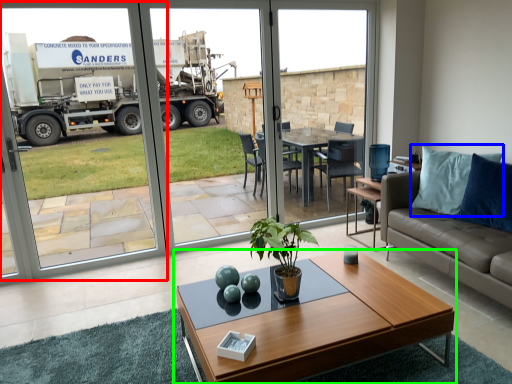
Question: Which is farther away from screen door (highlighted by a red box)? pillow (highlighted by a blue box) or coffee table (highlighted by a green box)?

Choices:
 (A) pillow
 (B) coffee table

Answer: (A)